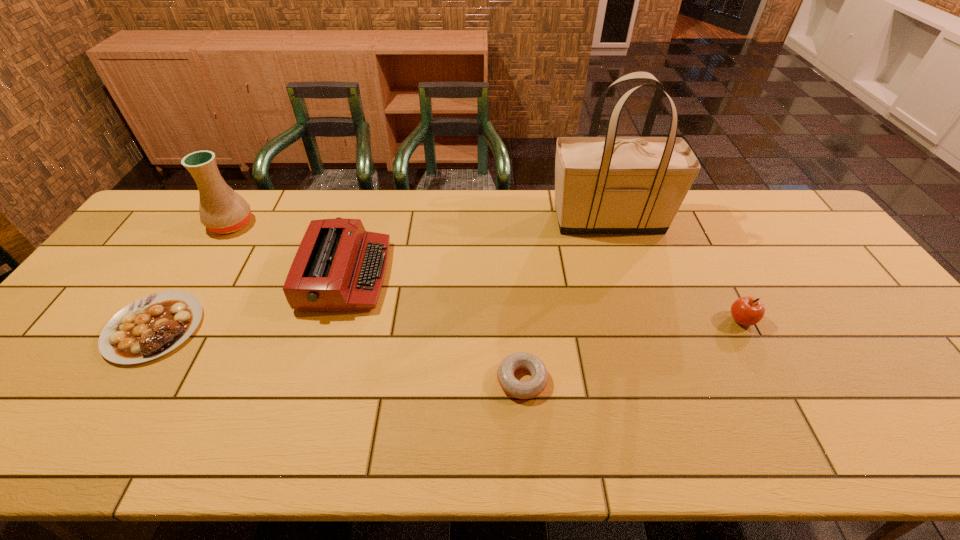
Identify which object is located as the second nearest to the third object from right to left. Please provide its 2D coordinates. Your answer should be formatted as a tuple, i.e. [(x, y)], where the tuple contains the x and y coordinates of a point satisfying the conditions above.

[(610, 184)]

Locate an element on the screen. Image resolution: width=960 pixels, height=540 pixels. object that is the fifth closest to the doughnut is located at coordinates click(222, 210).

This screenshot has width=960, height=540. I want to click on vacant space that satisfies the following two spatial constraints: 1. on the front side of the fifth shortest object; 2. on the left side of the doughnut, so click(x=135, y=380).

Locate an element on the screen. free location that satisfies the following two spatial constraints: 1. with handles facing forward on the tallest object; 2. on the front side of the steak is located at coordinates (643, 328).

The height and width of the screenshot is (540, 960). Identify the location of free spot that satisfies the following two spatial constraints: 1. on the typing side of the apple; 2. on the left side of the typewriter. (333, 320).

Locate an element on the screen. This screenshot has width=960, height=540. vacant region that satisfies the following two spatial constraints: 1. on the typing side of the fourth object from right to left; 2. on the back side of the apple is located at coordinates (333, 320).

Image resolution: width=960 pixels, height=540 pixels. I want to click on vacant space that satisfies the following two spatial constraints: 1. with handles facing forward on the rightmost object; 2. on the left side of the second object from right to left, so click(x=640, y=320).

The image size is (960, 540). What are the coordinates of `free space that satisfies the following two spatial constraints: 1. on the typing side of the fourth object from right to left; 2. on the front side of the steak` in the screenshot? It's located at (330, 328).

You are a GUI agent. You are given a task and a screenshot of the screen. Output one action in this format:
    pyautogui.click(x=<x>, y=<y>)
    Task: Click on the vacant space that satisfies the following two spatial constraints: 1. on the typing side of the third object from right to left; 2. on the right side of the typewriter
    The height and width of the screenshot is (540, 960).
    Given the screenshot: What is the action you would take?
    pyautogui.click(x=316, y=380)